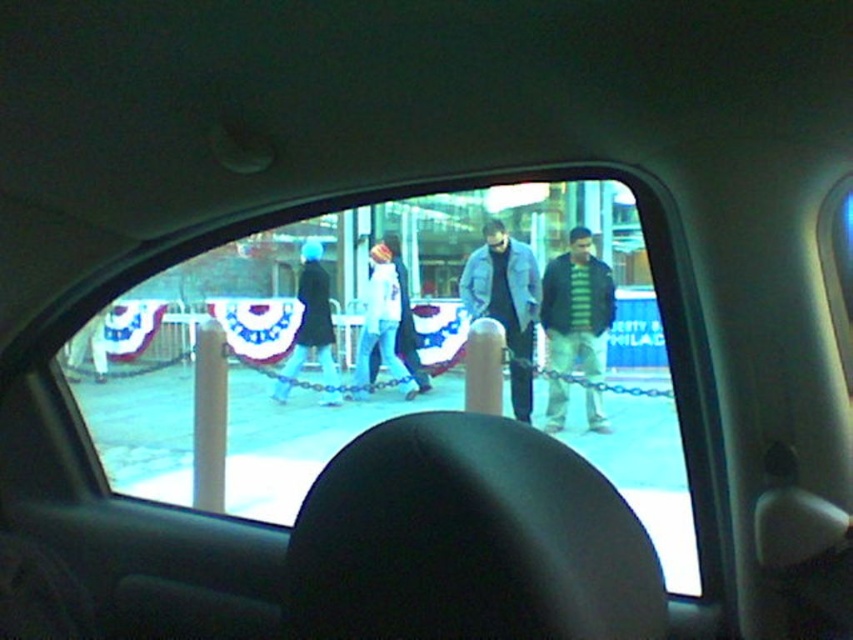
Question: Among these points, which one is nearest to the camera?

Choices:
 (A) (579, 362)
 (B) (170, 268)
 (C) (312, 291)
 (D) (506, 340)

Answer: (B)

Question: Which of these objects is positioned closest to the light blue denim jacket at center?

Choices:
 (A) black coat at center
 (B) transparent glass window at center
 (C) striped knit sweater at center

Answer: (A)

Question: Does transparent glass window at center appear on the left side of denim jacket at center?

Choices:
 (A) yes
 (B) no

Answer: (B)

Question: Which point appears closest to the camera in this image?

Choices:
 (A) (555, 387)
 (B) (415, 221)
 (C) (289, 355)
 (D) (397, 364)

Answer: (A)

Question: Does transparent glass window at center have a lesser width compared to light blue denim jacket at center?

Choices:
 (A) yes
 (B) no

Answer: (A)

Question: Does transparent glass window at center lie in front of denim jacket at center?

Choices:
 (A) yes
 (B) no

Answer: (A)